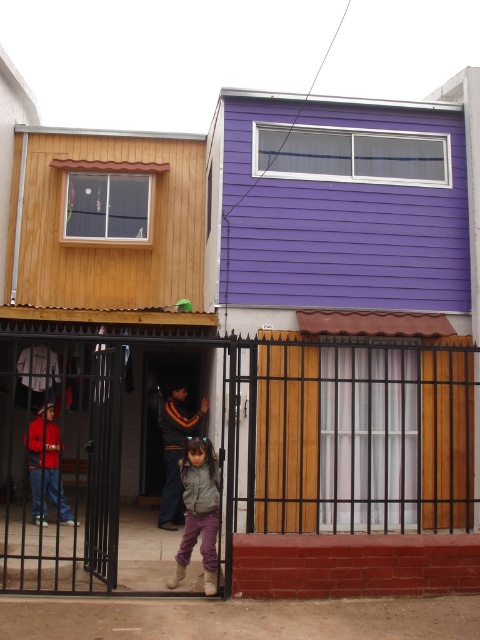
Question: From the image, what is the correct spatial relationship of wooden door at center in relation to matte red jacket at center?

Choices:
 (A) above
 (B) below

Answer: (A)

Question: Which point appears closest to the camera in this image?

Choices:
 (A) (205, 547)
 (B) (31, 456)
 (C) (181, 419)

Answer: (A)

Question: Is gray fuzzy jacket at center further to the viewer compared to matte red jacket at center?

Choices:
 (A) yes
 (B) no

Answer: (B)

Question: Does gray fuzzy jacket at center have a greater width compared to gray woolen sweater at center?

Choices:
 (A) yes
 (B) no

Answer: (B)

Question: Which point is farther to the camera?

Choices:
 (A) gray woolen sweater at center
 (B) gray fuzzy jacket at center
 (C) matte red jacket at center

Answer: (A)

Question: Which object is closer to the camera taking this photo?

Choices:
 (A) gray woolen sweater at center
 (B) matte red jacket at center
 (C) wooden door at center

Answer: (B)